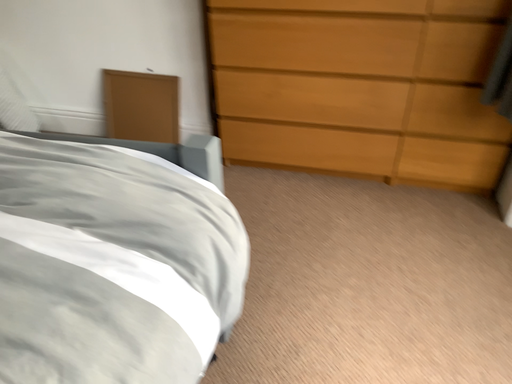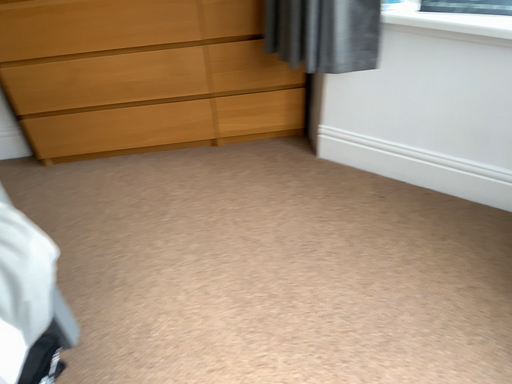
Question: How did the camera likely rotate when shooting the video?

Choices:
 (A) rotated left
 (B) rotated right

Answer: (B)